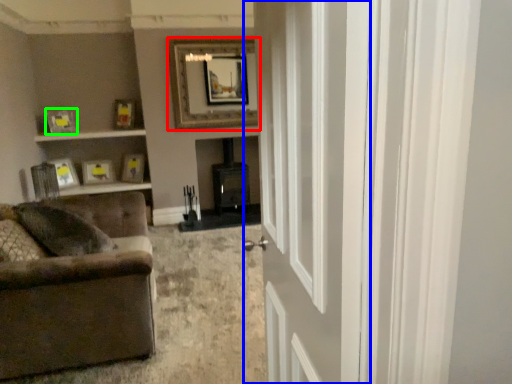
Question: Which object is positioned closest to picture frame (highlighted by a red box)? Select from door (highlighted by a blue box) and picture frame (highlighted by a green box).

Choices:
 (A) door
 (B) picture frame

Answer: (B)